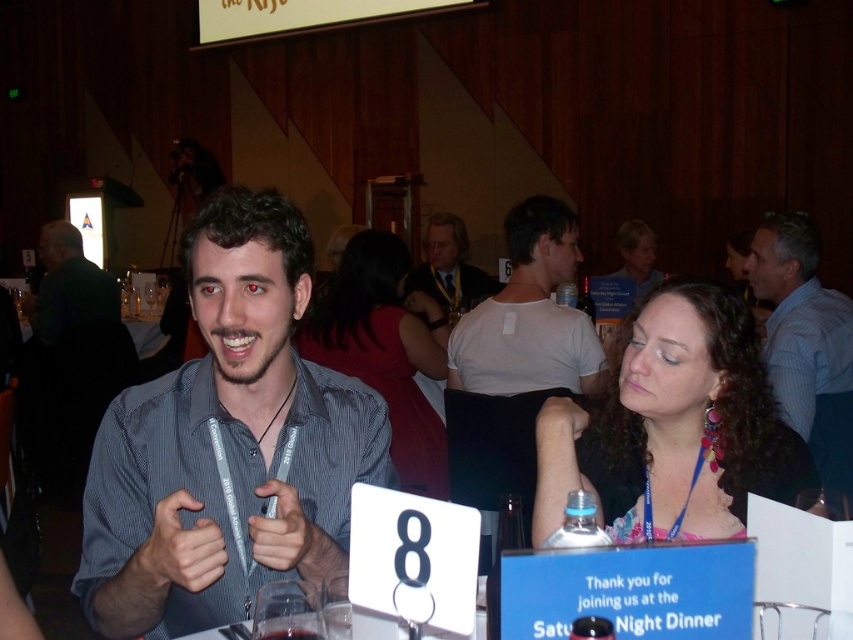
You are organizing a photo shoot in the conference hall and need to place two props on the table where the curly hair at center and blue striped shirt at upper right are seated. The props must be placed such that the wider object is on the left side of the table. Which object should be placed on the left side?

The curly hair at center should be placed on the left side of the table because its width surpasses that of the blue striped shirt at upper right.

You are standing at the entrance of the hall and see the two people at the table. Which object, curly hair at center or blue striped shirt at upper right, is positioned higher from the ground?

The blue striped shirt at upper right is positioned higher from the ground than the curly hair at center.